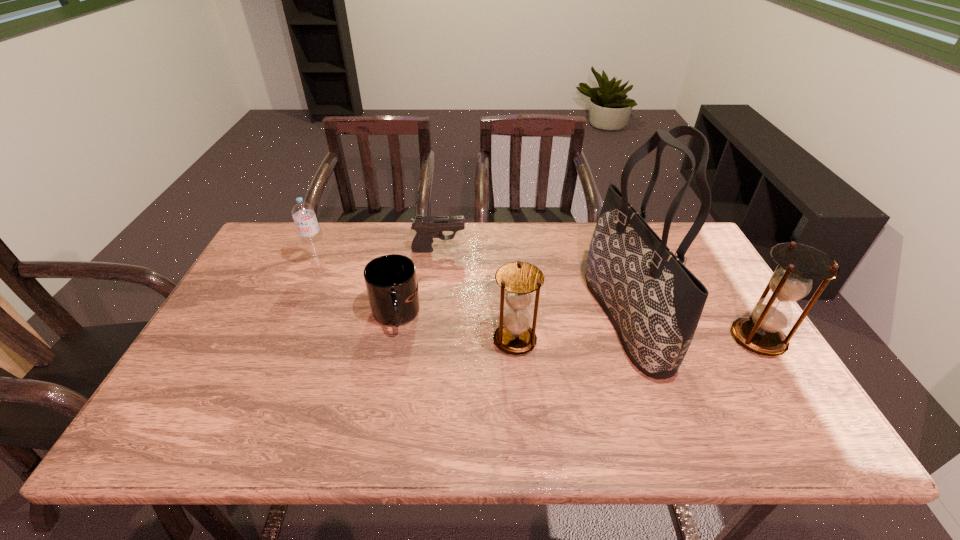
Locate an element on the screen. The height and width of the screenshot is (540, 960). vacant point at the near edge is located at coordinates (364, 389).

Locate an element on the screen. The height and width of the screenshot is (540, 960). vacant area at the left edge is located at coordinates click(235, 316).

Locate an element on the screen. This screenshot has height=540, width=960. vacant space at the right edge of the desktop is located at coordinates (717, 278).

Locate an element on the screen. Image resolution: width=960 pixels, height=540 pixels. free spot at the far left corner of the desktop is located at coordinates (323, 222).

Locate an element on the screen. free location at the far right corner is located at coordinates (655, 223).

This screenshot has width=960, height=540. Find the location of `free space between the fourth object from left to right and the mug`. free space between the fourth object from left to right and the mug is located at coordinates (455, 328).

Find the location of a particular element. The width and height of the screenshot is (960, 540). free space between the rightmost object and the mug is located at coordinates (577, 327).

The height and width of the screenshot is (540, 960). In order to click on vacant area that lies between the water bottle and the tote bag in this screenshot , I will do `click(471, 291)`.

The width and height of the screenshot is (960, 540). I want to click on vacant space that's between the tote bag and the water bottle, so click(471, 291).

At what (x,y) coordinates should I click in order to perform the action: click on free space between the mug and the right hourglass. Please return your answer as a coordinate pair (x, y). The image size is (960, 540). Looking at the image, I should click on (577, 327).